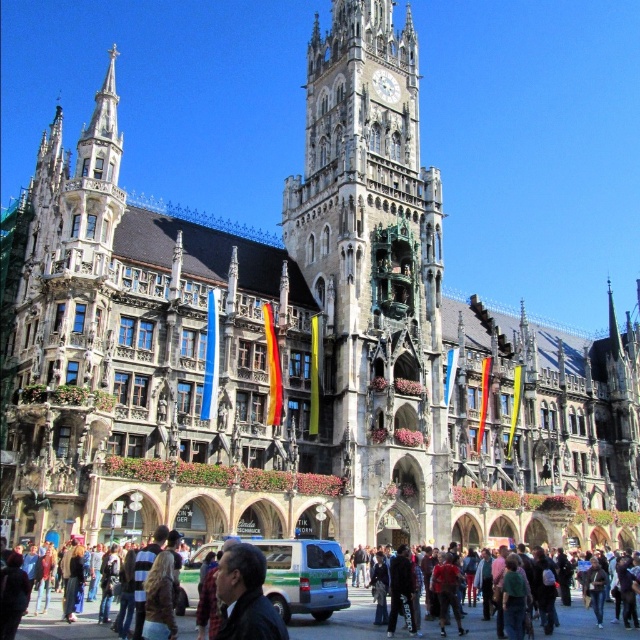
You are standing at the Marienplatz in Munich and want to take a photo of the New Town Hall without any people in the frame. The dark clothing crowd at lower center is currently blocking your view. Where should you move to get an unobstructed view of the New Town Hall?

To avoid the dark clothing crowd at lower center, move to a position where you can see above or to the sides of them. Since they are at point (584,625), moving slightly to the left or right or stepping back might provide a clearer view of the New Town Hall.

You are standing at Marienplatz in Munich, Germany, and you see the golden stone clock tower at center. If you want to take a photo of it from exactly 50 meters away, would you need to move closer or farther away?

The golden stone clock tower at center is currently 55.02 meters away from you. To take a photo from exactly 50 meters away, you would need to move closer by approximately 5.02 meters.